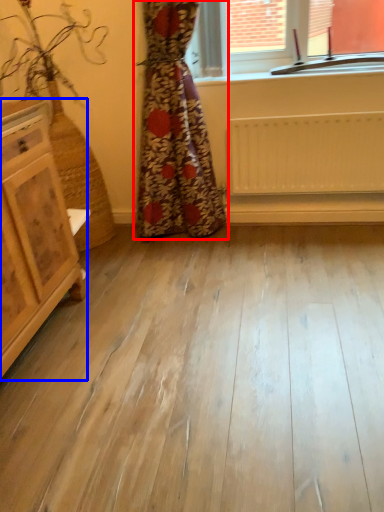
Question: Among these objects, which one is nearest to the camera, curtain (highlighted by a red box) or chest of drawers (highlighted by a blue box)?

Choices:
 (A) curtain
 (B) chest of drawers

Answer: (B)